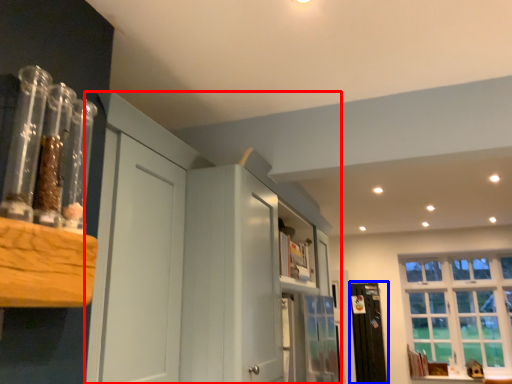
Question: Which of the following is the closest to the observer, dresser (highlighted by a red box) or screen door (highlighted by a blue box)?

Choices:
 (A) dresser
 (B) screen door

Answer: (A)